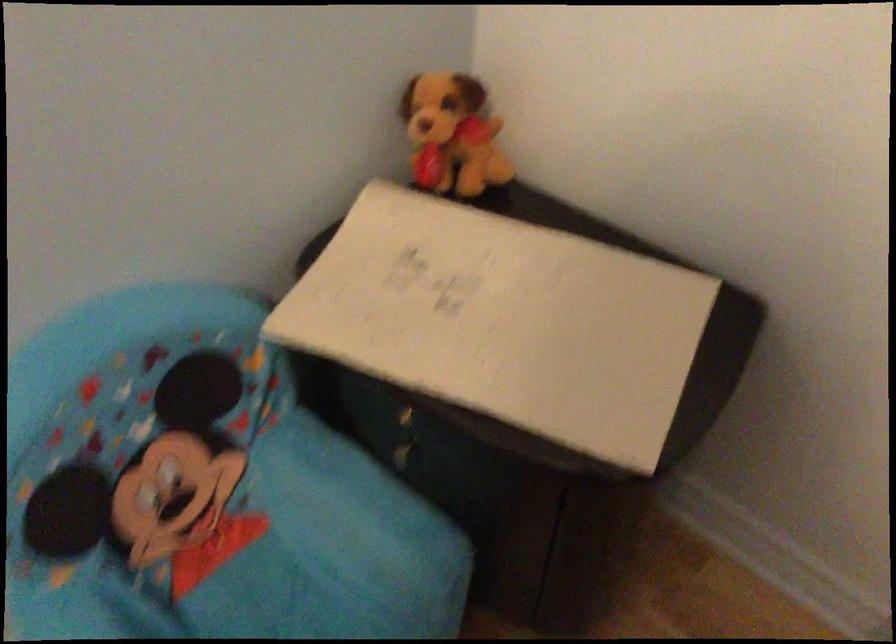
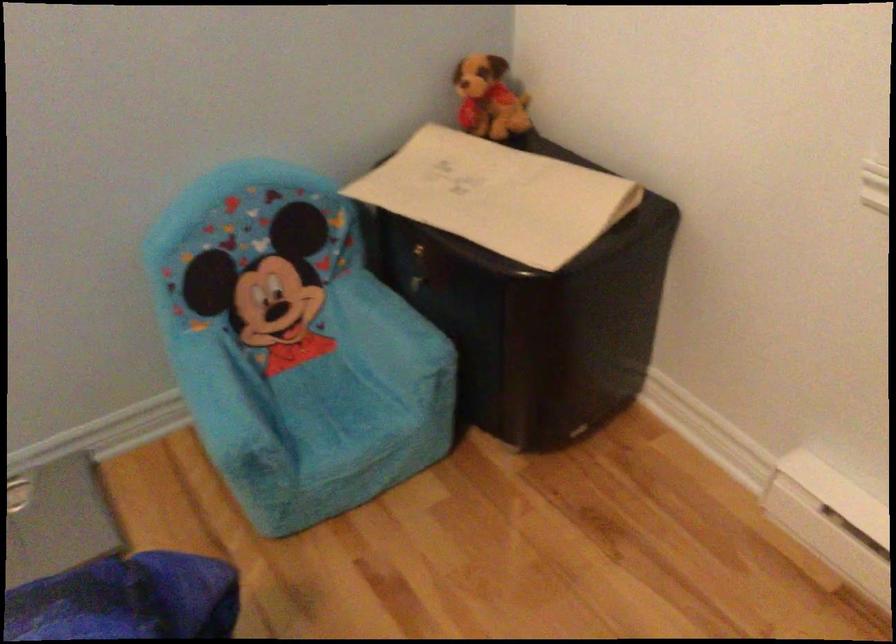
Locate, in the second image, the point that corresponds to point 362,494 in the first image.

(389, 316)